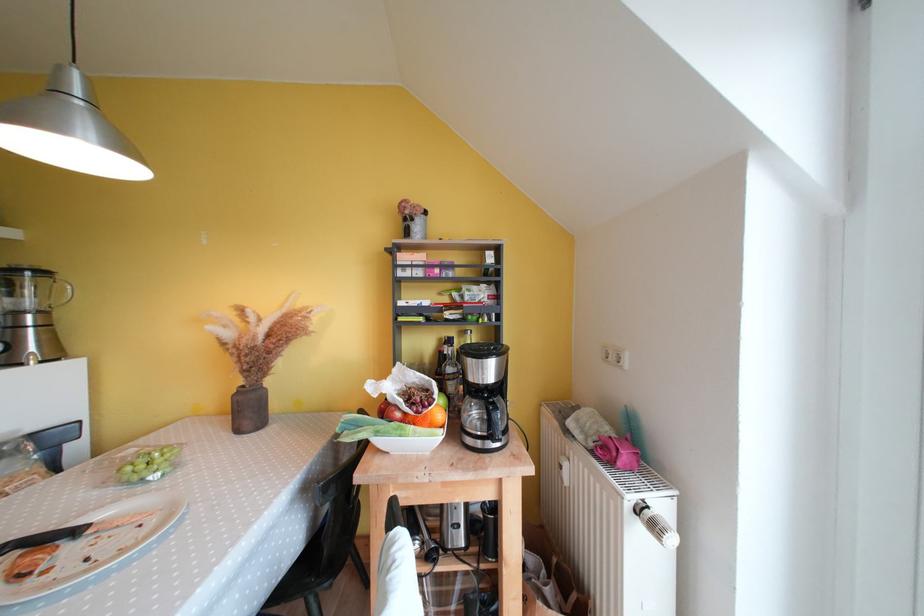
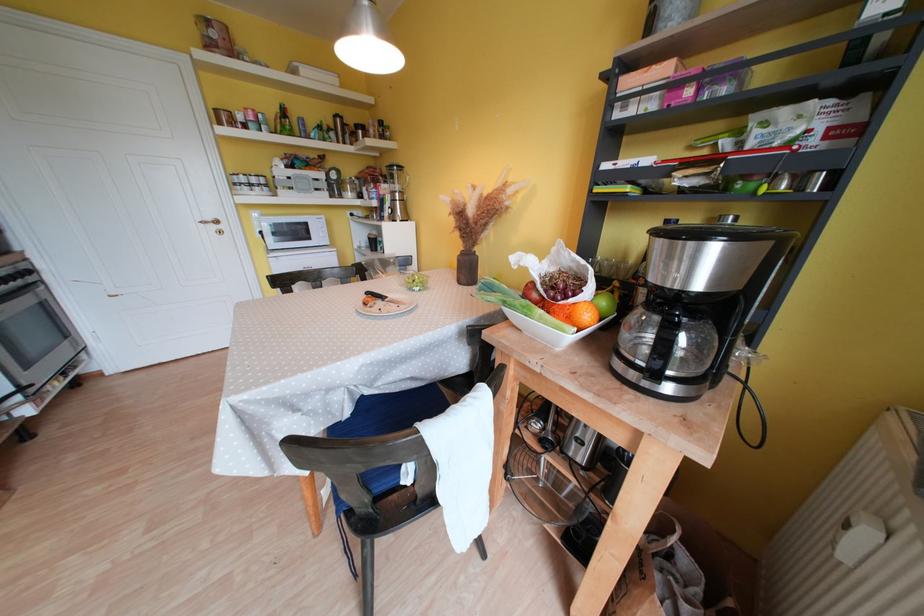
How did the camera likely rotate?

The camera rotated toward left-down.